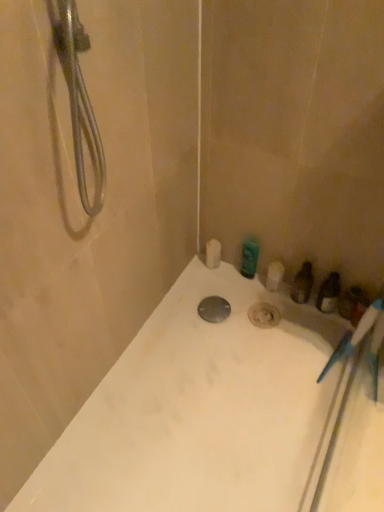
Question: From the image's perspective, is white glossy bathtub at center positioned above or below translucent plastic bottle at right, the second toiletry when ordered from top to bottom?

Choices:
 (A) above
 (B) below

Answer: (B)

Question: Is white glossy bathtub at center in front of or behind translucent plastic bottle at right, the second toiletry when ordered from top to bottom, in the image?

Choices:
 (A) front
 (B) behind

Answer: (A)

Question: Which of these objects is positioned farthest from the green glossy bottle at upper right, the second toiletry viewed from the right?

Choices:
 (A) translucent plastic bottle at right, which is the second toiletry from left to right
 (B) white glossy bathtub at center
 (C) white matte toilet paper at upper center
 (D) metallic silver drain at center

Answer: (B)

Question: Which object is positioned farthest from the translucent plastic bottle at right, the second toiletry when ordered from top to bottom?

Choices:
 (A) metallic silver drain at center
 (B) white matte toilet paper at upper center
 (C) green glossy bottle at upper right, the second toiletry from the bottom
 (D) white glossy bathtub at center

Answer: (D)